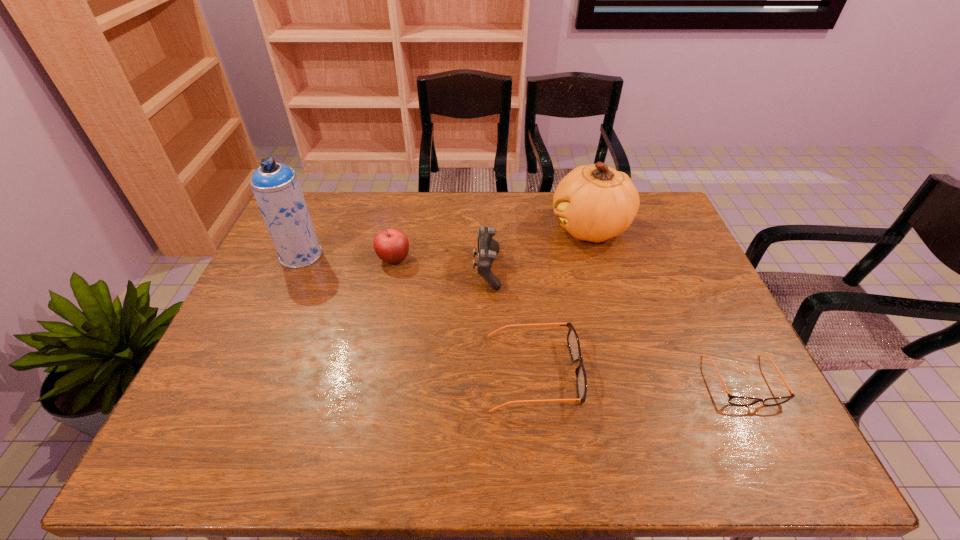
Where is `the taller spectacles`? the taller spectacles is located at coordinates (573, 342).

Find the location of a particular element. the second shortest object is located at coordinates (573, 342).

At what (x,y) coordinates should I click in order to perform the action: click on the shortest object. Please return your answer as a coordinate pair (x, y). Image resolution: width=960 pixels, height=540 pixels. Looking at the image, I should click on (734, 400).

Find the location of `the shorter spectacles`. the shorter spectacles is located at coordinates (734, 400).

The width and height of the screenshot is (960, 540). Identify the location of the tallest object. (276, 187).

This screenshot has width=960, height=540. I want to click on the leftmost object, so click(276, 187).

Locate an element on the screen. the fifth shortest object is located at coordinates (595, 202).

This screenshot has height=540, width=960. I want to click on apple, so click(x=391, y=245).

Image resolution: width=960 pixels, height=540 pixels. Find the location of `control`. control is located at coordinates (488, 248).

At what (x,y) coordinates should I click in order to perform the action: click on vacant area located 0.050m on the front-facing side of the taller spectacles. Please return your answer as a coordinate pair (x, y). The width and height of the screenshot is (960, 540). Looking at the image, I should click on (600, 373).